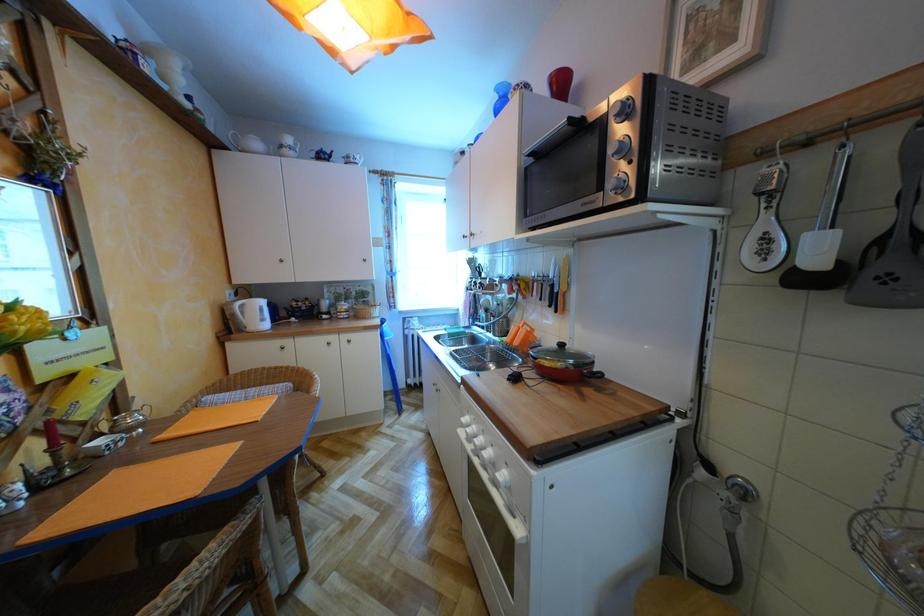
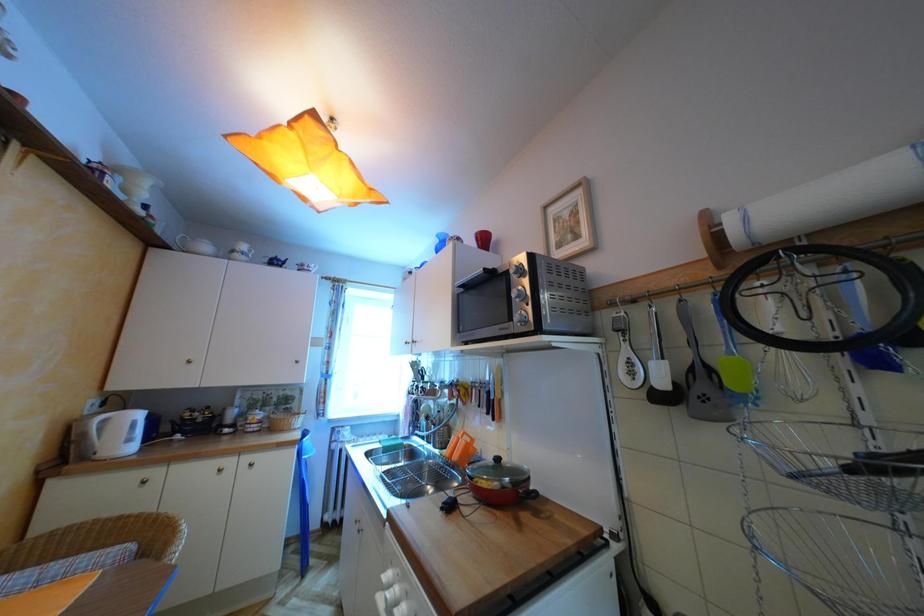
Question: Based on the continuous images, in which direction is the camera rotating? Reply with the corresponding letter.

Choices:
 (A) Left
 (B) Right
 (C) Up
 (D) Down

Answer: (C)